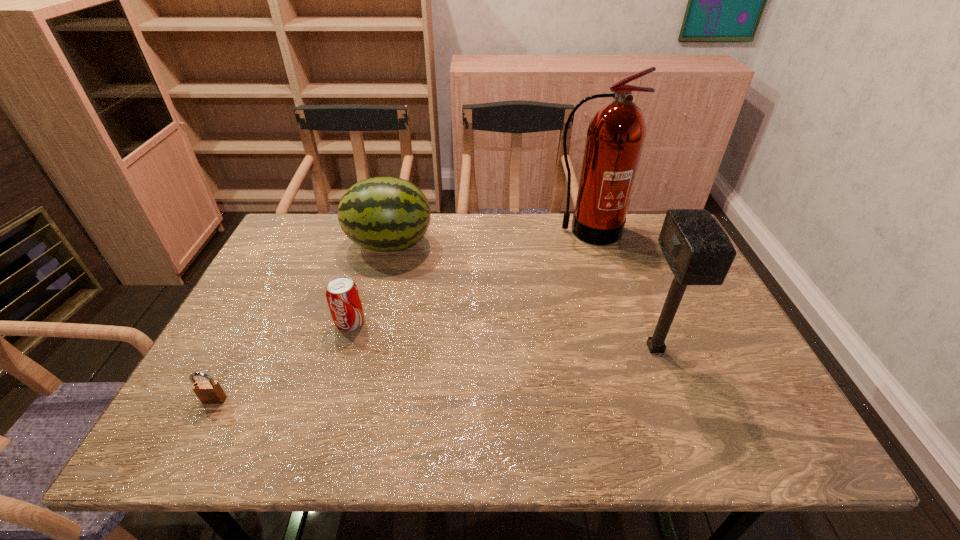
You are a GUI agent. You are given a task and a screenshot of the screen. Output one action in this format:
    pyautogui.click(x=<x>, y=<y>)
    Task: Click on the free point between the shortest object and the second shortest object
    Image resolution: width=960 pixels, height=540 pixels.
    Given the screenshot: What is the action you would take?
    pyautogui.click(x=282, y=361)

Identify the location of unoccupied area between the shortest object and the third tallest object. The image size is (960, 540). (302, 322).

I want to click on vacant space that's between the fourth tallest object and the tallest object, so click(468, 277).

Image resolution: width=960 pixels, height=540 pixels. Identify the location of vacant point located between the mallet and the third tallest object. (522, 296).

Image resolution: width=960 pixels, height=540 pixels. What are the coordinates of `empty location between the mallet and the padlock` in the screenshot? It's located at [x=435, y=374].

Where is `free space between the fire extinguisher and the nearest object`? This screenshot has width=960, height=540. free space between the fire extinguisher and the nearest object is located at coordinates (400, 315).

The height and width of the screenshot is (540, 960). I want to click on vacant region between the third shortest object and the leftmost object, so click(x=302, y=322).

The width and height of the screenshot is (960, 540). I want to click on free space between the leftmost object and the tallest object, so click(x=400, y=315).

Locate an element on the screen. This screenshot has width=960, height=540. free space between the third tallest object and the fourth tallest object is located at coordinates (370, 284).

Identify the location of object that is the fourth nearest to the watermelon. The width and height of the screenshot is (960, 540). (698, 251).